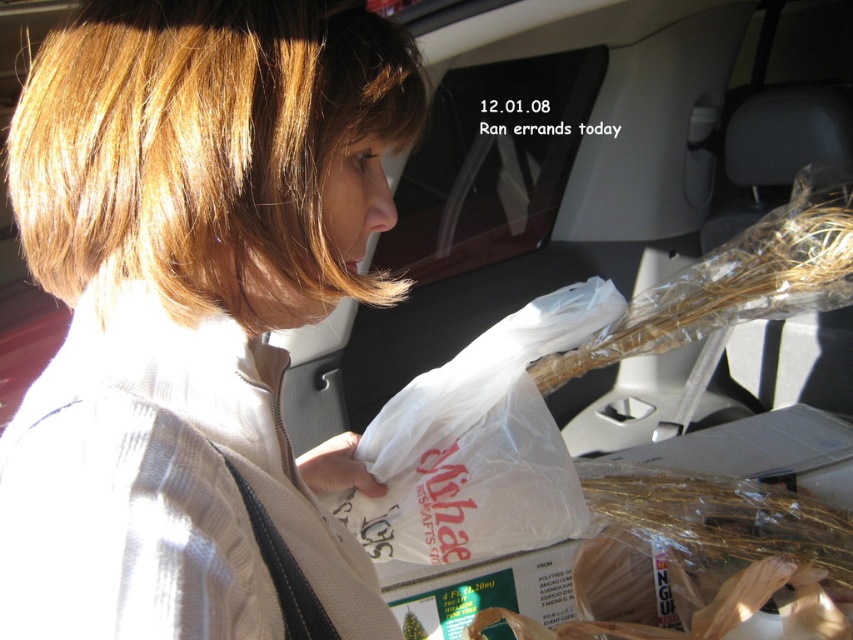
Does light brown hair at upper left have a lesser height compared to white plastic grocery bag at center?

In fact, light brown hair at upper left may be taller than white plastic grocery bag at center.

In the scene shown: Who is taller, light brown hair at upper left or white plastic grocery bag at center?

Standing taller between the two is light brown hair at upper left.

This screenshot has width=853, height=640. In order to click on light brown hair at upper left in this screenshot , I will do `click(192, 308)`.

This screenshot has width=853, height=640. Find the location of `light brown hair at upper left`. light brown hair at upper left is located at coordinates (192, 308).